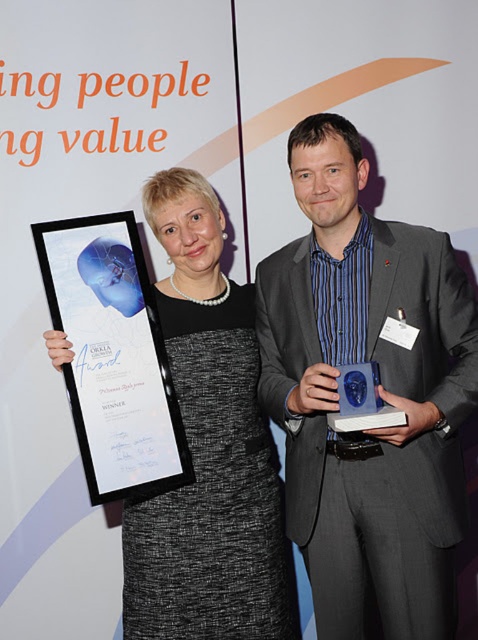
Can you confirm if black textured dress at center is positioned below black glossy plaque at left?

Yes.

Is point (201, 520) behind point (113, 337)?

Yes.

Where is `black textured dress at center`? The height and width of the screenshot is (640, 478). black textured dress at center is located at coordinates (208, 451).

Consider the image. Who is more distant from viewer, (443, 532) or (74, 259)?

The point (74, 259) is behind.

Is matte gray suit at center smaller than black glossy plaque at left?

No, matte gray suit at center is not smaller than black glossy plaque at left.

Who is more distant from viewer, (355,307) or (74,371)?

The point (355,307) is more distant.

Locate an element on the screen. The width and height of the screenshot is (478, 640). matte gray suit at center is located at coordinates point(379,392).

Measure the distance between matte gray suit at center and camera.

matte gray suit at center and camera are 4.69 feet apart from each other.

Can you confirm if matte gray suit at center is shorter than black textured dress at center?

No, matte gray suit at center is not shorter than black textured dress at center.

At what (x,y) coordinates should I click in order to perform the action: click on matte gray suit at center. Please return your answer as a coordinate pair (x, y). Looking at the image, I should click on (379, 392).